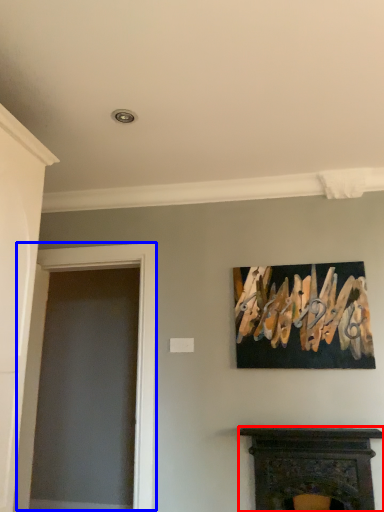
Question: Which object appears farthest to the camera in this image, fireplace (highlighted by a red box) or glass door (highlighted by a blue box)?

Choices:
 (A) fireplace
 (B) glass door

Answer: (B)